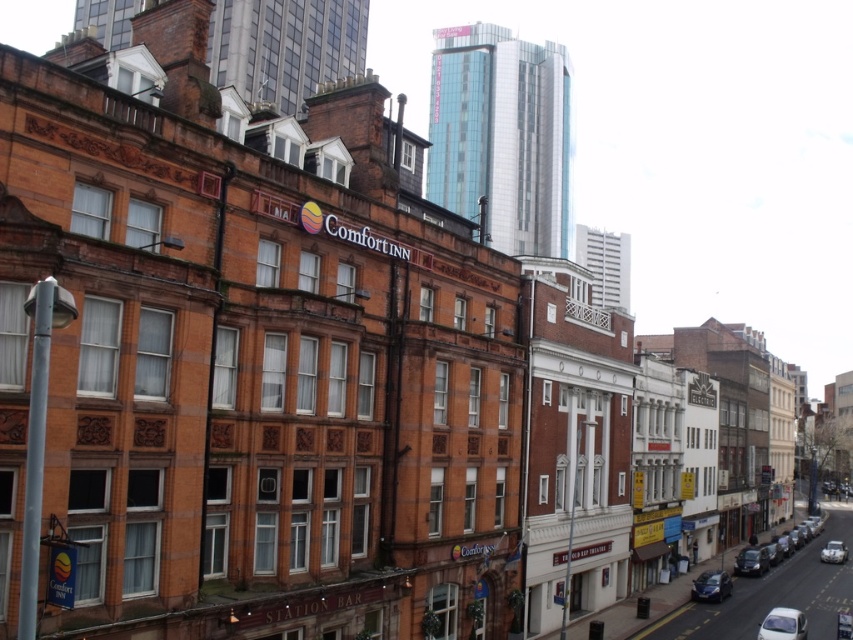
Question: Which of these objects is positioned closest to the white glossy car at lower right?

Choices:
 (A) shiny silver car at lower right
 (B) shiny black car at lower right
 (C) metallic silver car at lower right
 (D) silver metallic car at lower right

Answer: (C)

Question: Is white glossy car at lower right further to the viewer compared to shiny black car at lower right?

Choices:
 (A) yes
 (B) no

Answer: (B)

Question: Which of the following is the farthest from the observer?

Choices:
 (A) shiny black car at lower right
 (B) white glossy car at lower right
 (C) shiny silver car at lower right
 (D) silver metallic car at lower right

Answer: (D)

Question: Is white glossy car at lower right to the left of silver metallic car at lower right from the viewer's perspective?

Choices:
 (A) no
 (B) yes

Answer: (B)

Question: Is shiny black car at lower right positioned before metallic silver car at lower right?

Choices:
 (A) no
 (B) yes

Answer: (A)

Question: Which object is farther from the camera taking this photo?

Choices:
 (A) metallic silver car at lower right
 (B) shiny silver car at lower right
 (C) shiny black car at lower right

Answer: (C)